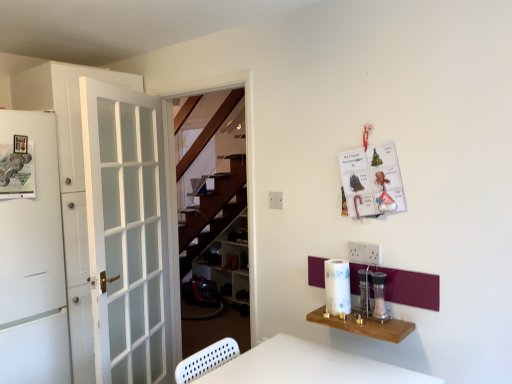
At what (x,y) coordinates should I click in order to perform the action: click on free space to the left of clear glass salt and pepper shakers at right, the second appliance in the left-to-right sequence. Please return your answer as a coordinate pair (x, y). Looking at the image, I should click on (356, 318).